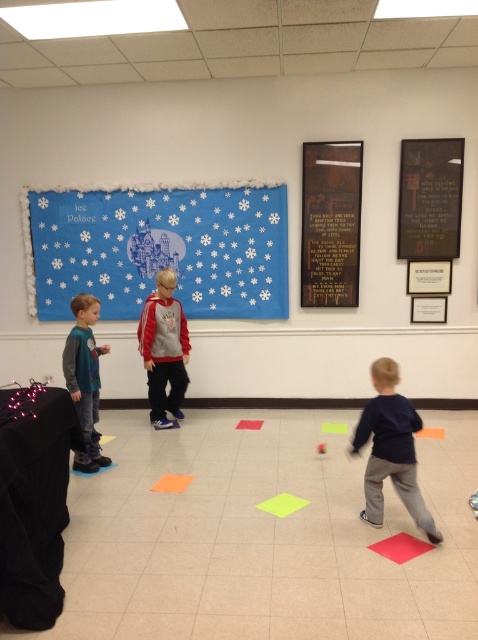
Question: Can you confirm if wooden plaque at upper center is positioned to the right of red rubber mat at lower right?

Choices:
 (A) yes
 (B) no

Answer: (B)

Question: Which of the following is the farthest from the observer?

Choices:
 (A) (240, 420)
 (B) (170, 275)
 (C) (97, 378)

Answer: (A)

Question: Which object is the farthest from the wooden plaque at upper center?

Choices:
 (A) orange matte mat at center
 (B) blue paper poster at upper center
 (C) matte gray hoodie at left

Answer: (A)

Question: Which point is closer to the camera taking this photo?

Choices:
 (A) (181, 477)
 (B) (393, 534)
 (C) (76, 392)

Answer: (B)

Question: Is blue paper poster at upper center wider than green paper at center?

Choices:
 (A) yes
 (B) no

Answer: (A)

Question: Can you confirm if black matte chalkboard at upper right is positioned to the right of matte red hoodie at center?

Choices:
 (A) no
 (B) yes

Answer: (B)